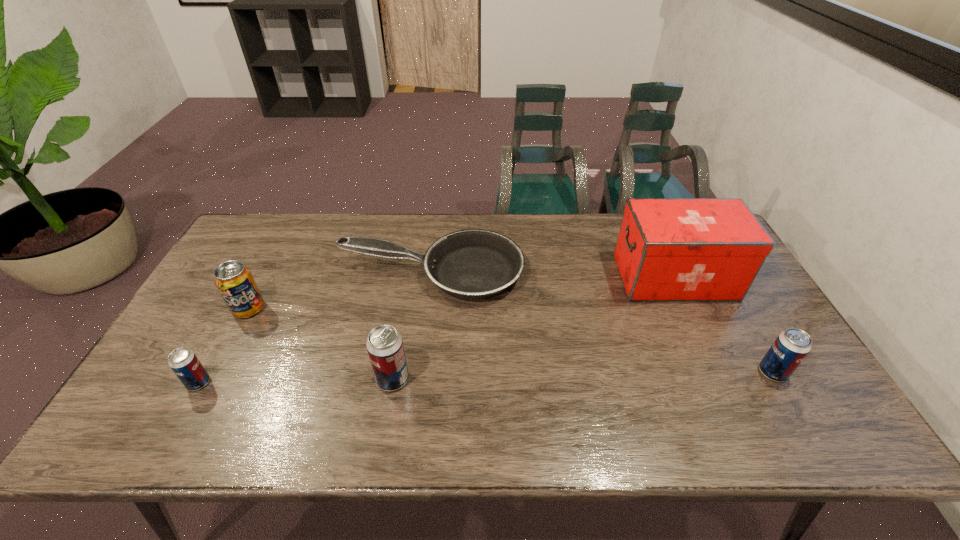
Locate an element on the screen. The image size is (960, 540). free space located 0.160m on the right of the shortest object is located at coordinates (575, 272).

You are a GUI agent. You are given a task and a screenshot of the screen. Output one action in this format:
    pyautogui.click(x=<x>, y=<y>)
    Task: Click on the vacant space located on the handle side of the first-aid kit
    The height and width of the screenshot is (540, 960).
    Given the screenshot: What is the action you would take?
    [537, 277]

Where is `vacant space located 0.190m on the handle side of the first-aid kit`? The image size is (960, 540). vacant space located 0.190m on the handle side of the first-aid kit is located at coordinates (556, 277).

Where is `blank space located 0.380m on the handle side of the first-aid kit`? This screenshot has height=540, width=960. blank space located 0.380m on the handle side of the first-aid kit is located at coordinates (494, 277).

I want to click on free space located 0.190m on the front of the soda can, so click(x=212, y=379).

This screenshot has height=540, width=960. I want to click on frying pan that is at the far edge, so click(473, 263).

The image size is (960, 540). Identify the location of the first-aid kit located in the far edge section of the desktop. [x=668, y=249].

The height and width of the screenshot is (540, 960). Find the location of `beer can at the left edge`. beer can at the left edge is located at coordinates (184, 363).

Where is `soda can that is positioned at the left edge`? soda can that is positioned at the left edge is located at coordinates (235, 282).

Image resolution: width=960 pixels, height=540 pixels. In order to click on beer can situated at the right edge in this screenshot , I will do 791,346.